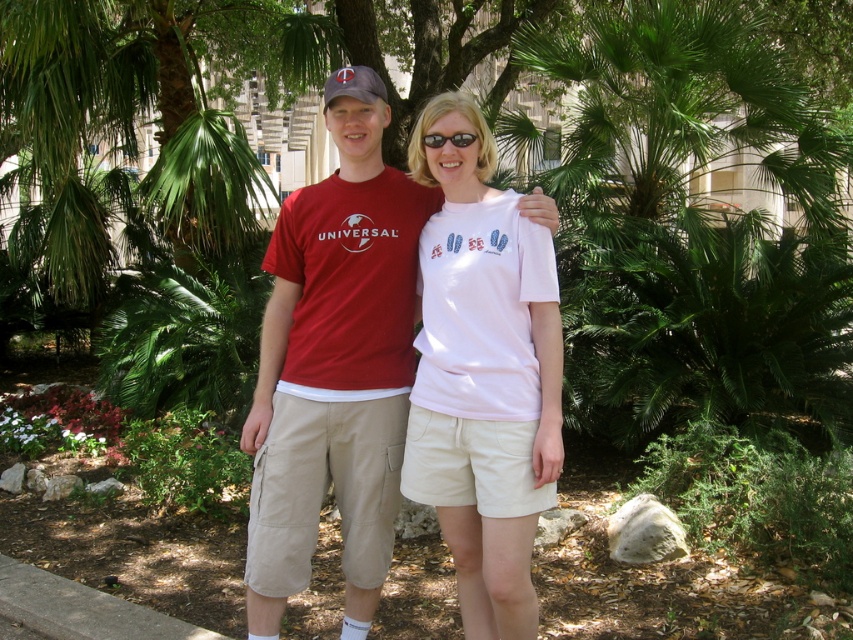
Please look at the image. There is a point at coordinates [483,372]. Based on the scene description, which object in the image does this point most likely belong to?

The point at coordinates [483,372] is on the white matte t shirt at center.

You are a photographer trying to capture a closeup shot of the matte brown baseball cap at upper center. Based on its coordinates, where should you aim your camera?

The matte brown baseball cap at upper center is located at point (352, 84).